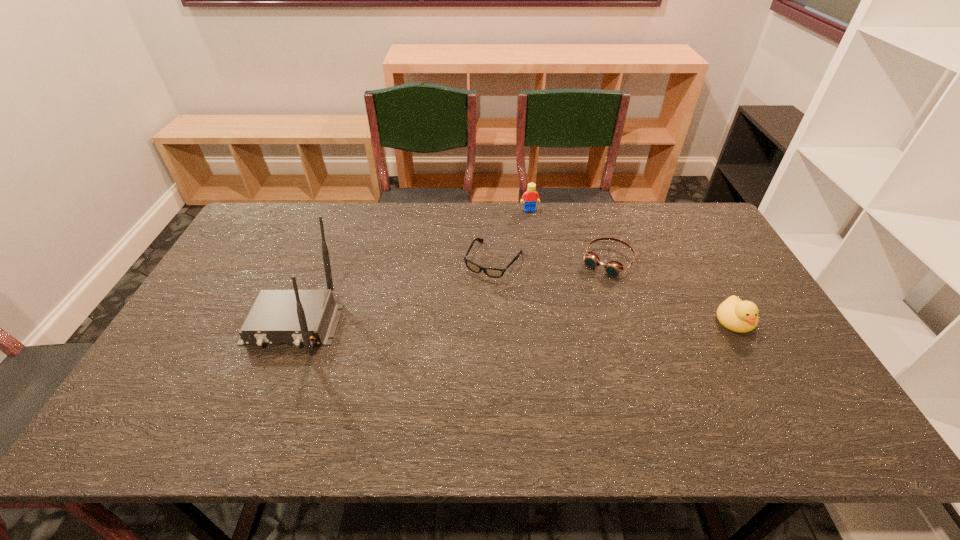
Identify the location of unoccupied position between the farthest object and the goggles. (568, 235).

This screenshot has width=960, height=540. In order to click on free point between the rightmost object and the spectacles in this screenshot , I will do `click(614, 291)`.

I want to click on free space between the third shortest object and the spectacles, so click(614, 291).

Where is `empty space between the fourth object from left to right and the third tallest object`? empty space between the fourth object from left to right and the third tallest object is located at coordinates (671, 291).

Find the location of a particular element. empty location between the spectacles and the third shortest object is located at coordinates (614, 291).

The width and height of the screenshot is (960, 540). I want to click on unoccupied position between the tallest object and the spectacles, so click(x=394, y=292).

Locate an element on the screen. The image size is (960, 540). vacant space that is in between the tallest object and the goggles is located at coordinates (450, 293).

Identify the location of vacant area between the duckling and the spectacles. The height and width of the screenshot is (540, 960). (614, 291).

Find the location of a particular element. This screenshot has height=540, width=960. blank region between the tallest object and the duckling is located at coordinates (514, 322).

Select which object is the fourth closest to the farthest object. Please provide its 2D coordinates. Your answer should be formatted as a tuple, i.e. [(x, y)], where the tuple contains the x and y coordinates of a point satisfying the conditions above.

[(296, 317)]